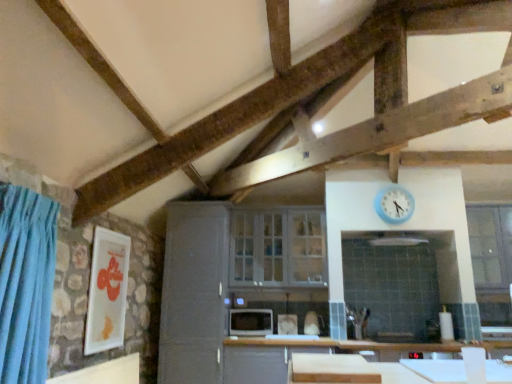
Where is `free space above blue plastic clock at upper right (from a real-world perspective)`? free space above blue plastic clock at upper right (from a real-world perspective) is located at coordinates (390, 188).